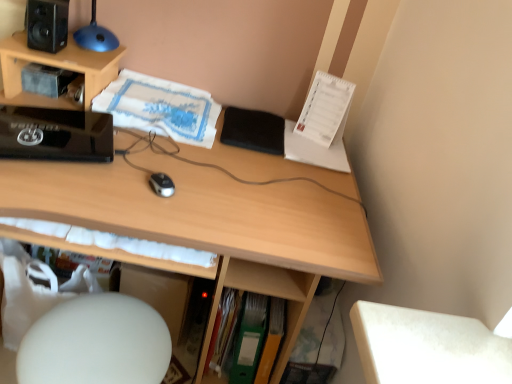
Question: From a real-world perspective, is black matte speaker at upper left positioned under black matte notepad at center based on gravity?

Choices:
 (A) yes
 (B) no

Answer: (B)

Question: Is the surface of black matte speaker at upper left in direct contact with black matte notepad at center?

Choices:
 (A) yes
 (B) no

Answer: (B)

Question: Can you confirm if black matte speaker at upper left is taller than black matte notepad at center?

Choices:
 (A) yes
 (B) no

Answer: (A)

Question: Considering the relative sizes of black matte speaker at upper left and black matte notepad at center in the image provided, is black matte speaker at upper left thinner than black matte notepad at center?

Choices:
 (A) yes
 (B) no

Answer: (A)

Question: Considering the relative positions of black matte speaker at upper left and black matte notepad at center in the image provided, is black matte speaker at upper left behind black matte notepad at center?

Choices:
 (A) no
 (B) yes

Answer: (A)

Question: Could you tell me if black matte speaker at upper left is facing black matte notepad at center?

Choices:
 (A) yes
 (B) no

Answer: (B)

Question: Is green matte folder at lower center, the second book viewed from the left, positioned with its back to white matte computer chair at lower left?

Choices:
 (A) no
 (B) yes

Answer: (A)

Question: Would you say green matte folder at lower center, the second book viewed from the left, is outside white matte computer chair at lower left?

Choices:
 (A) yes
 (B) no

Answer: (A)

Question: From a real-world perspective, is green matte folder at lower center, the 2th book when ordered from top to bottom, physically below white matte computer chair at lower left?

Choices:
 (A) yes
 (B) no

Answer: (A)

Question: From the image's perspective, is green matte folder at lower center, the first book positioned from the bottom, located above white matte computer chair at lower left?

Choices:
 (A) yes
 (B) no

Answer: (A)

Question: Considering the relative sizes of green matte folder at lower center, the second book viewed from the left, and white matte computer chair at lower left in the image provided, is green matte folder at lower center, the second book viewed from the left, shorter than white matte computer chair at lower left?

Choices:
 (A) no
 (B) yes

Answer: (B)

Question: Are black matte notepad at center and green matte folder at lower center, the second book viewed from the left, located far from each other?

Choices:
 (A) yes
 (B) no

Answer: (B)